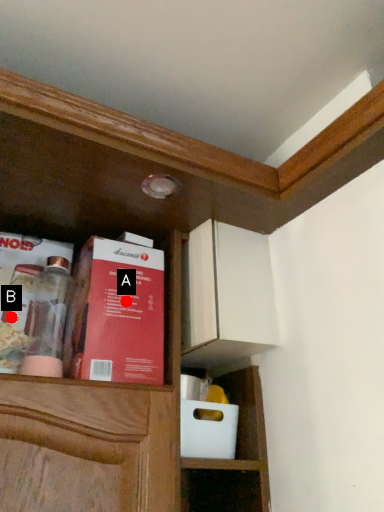
Question: Two points are circled on the image, labeled by A and B beside each circle. Which point is further to the camera?

Choices:
 (A) A is further
 (B) B is further

Answer: (A)